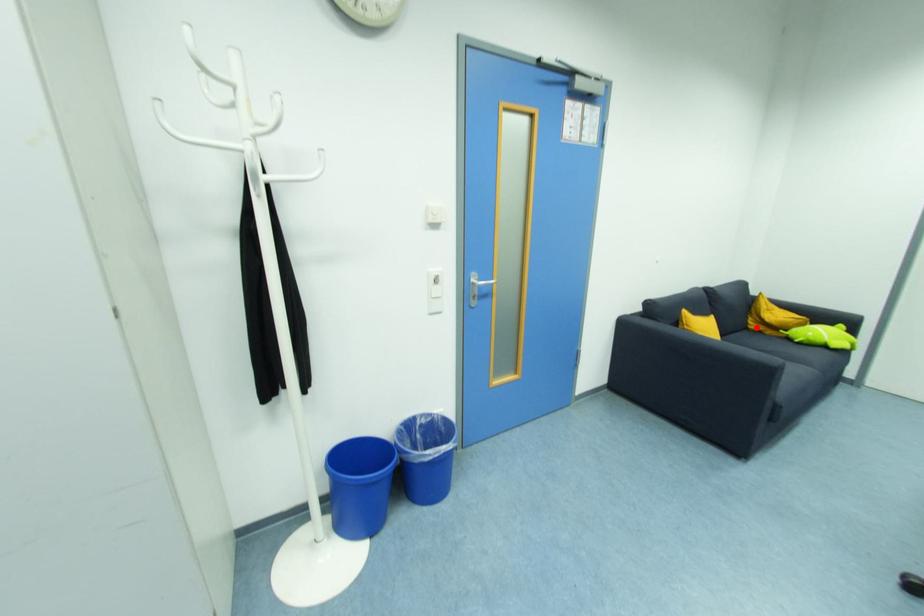
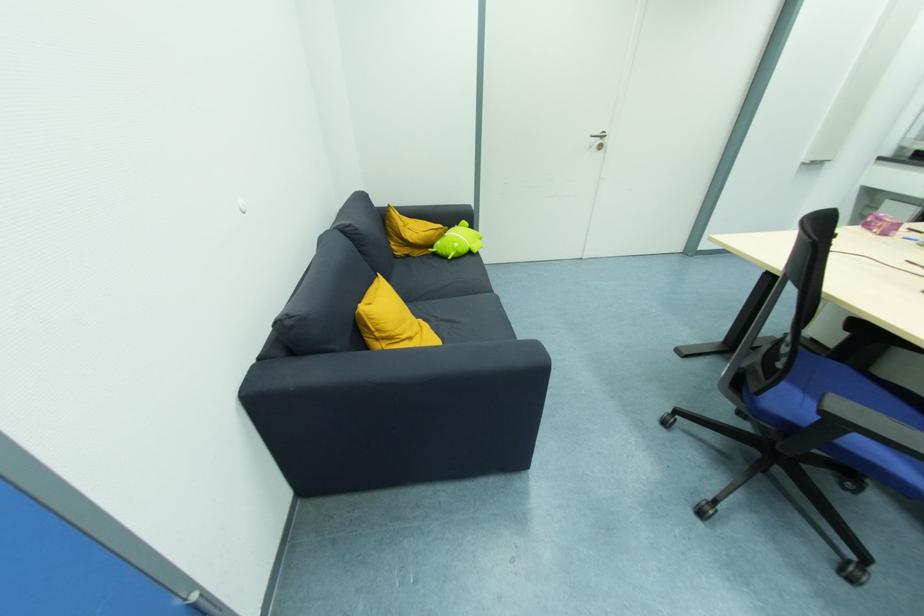
In the second image, find the point that corresponds to the highlighted location in the first image.

(403, 253)